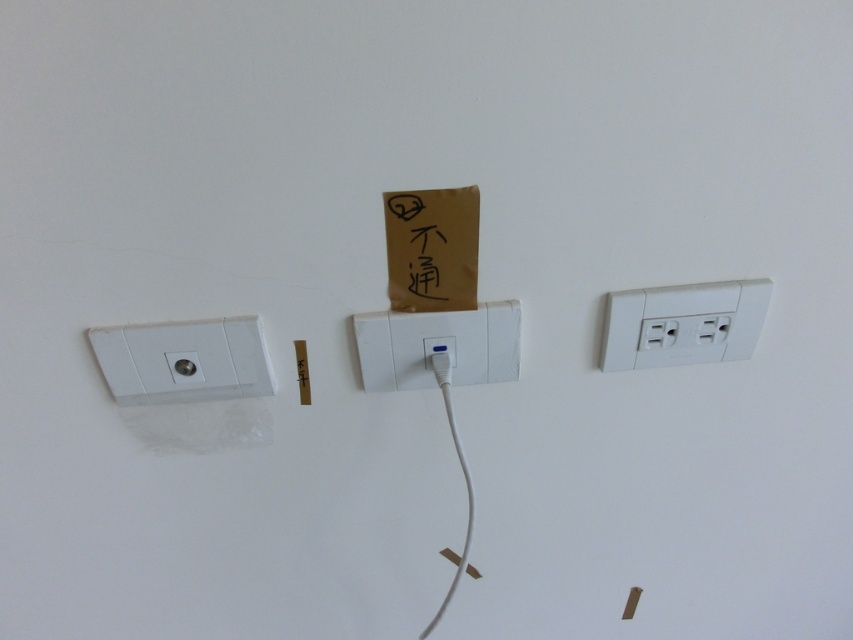
You are an electrician who needs to install a new cable that connects the white plastic socket at left and the white plastic usb port at center. The cable you have is 6 inches long. Will the cable be long enough to connect them without needing to be extended?

The distance between the white plastic socket at left and the white plastic usb port at center is 7.48 inches. Since the cable is only 6 inches long, it is not long enough to connect them without extension.

You are a technician holding a tool that is 30 inches long. You need to reach the white plastic electric outlet at right to fix it. Can you reach it without moving closer?

The white plastic electric outlet at right is 32.66 inches from viewer, which is slightly longer than the tool. Therefore, you cannot reach it without moving closer.

You are an electrician looking at the wall with the white plastic socket at left and the white plastic electric outlet at right. Which one is positioned more to the east side of the wall?

The white plastic socket at left is positioned more to the east side of the wall because it is to the left of the white plastic electric outlet at right.